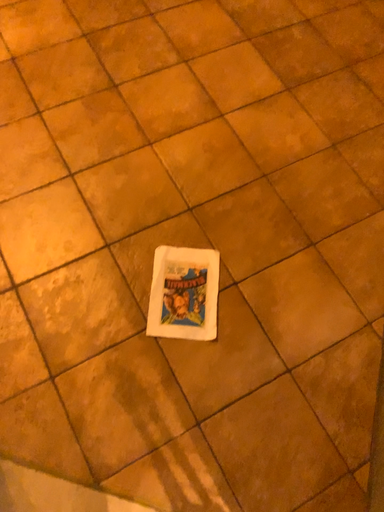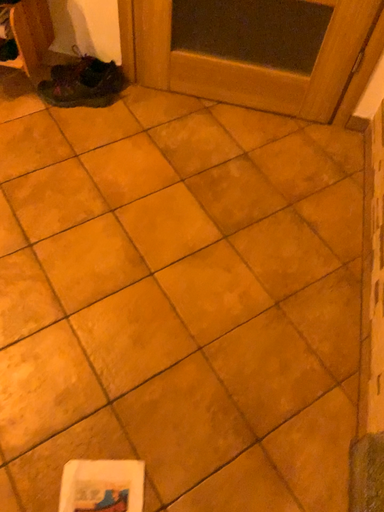
Question: How did the camera likely rotate when shooting the video?

Choices:
 (A) rotated upward
 (B) rotated downward

Answer: (A)